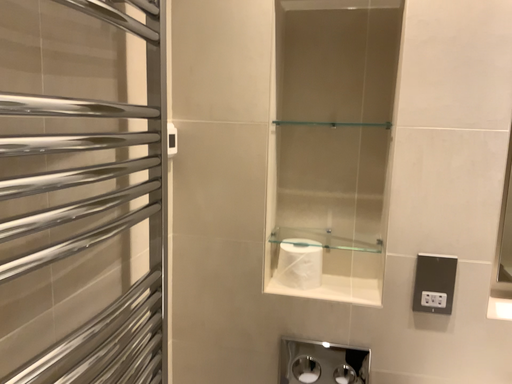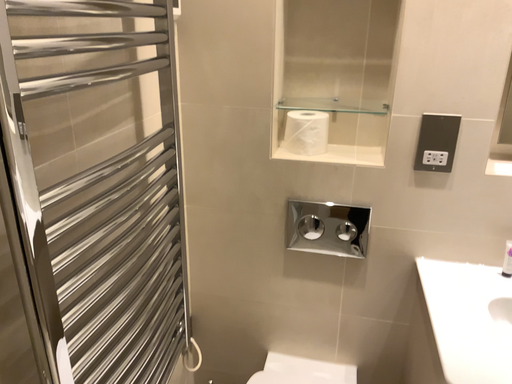
Question: Which way did the camera rotate in the video?

Choices:
 (A) rotated upward
 (B) rotated downward

Answer: (B)